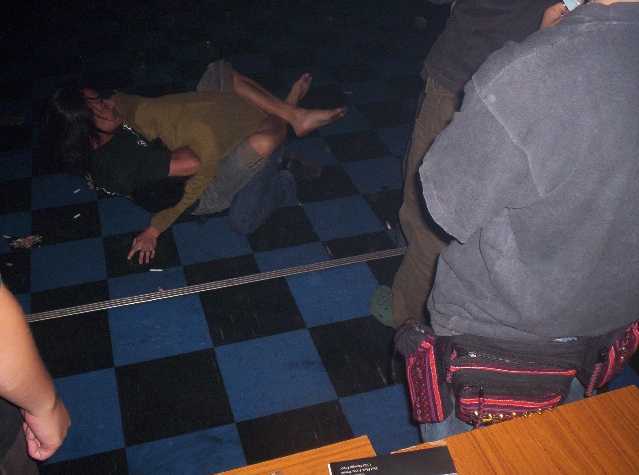
The image size is (639, 475). In order to click on checkerboard floor in this screenshot , I will do `click(328, 239)`.